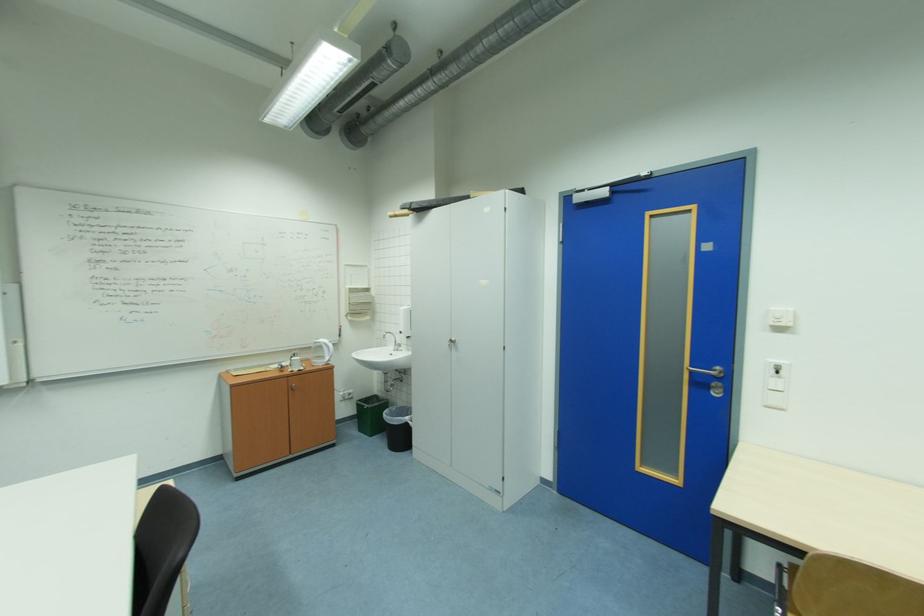
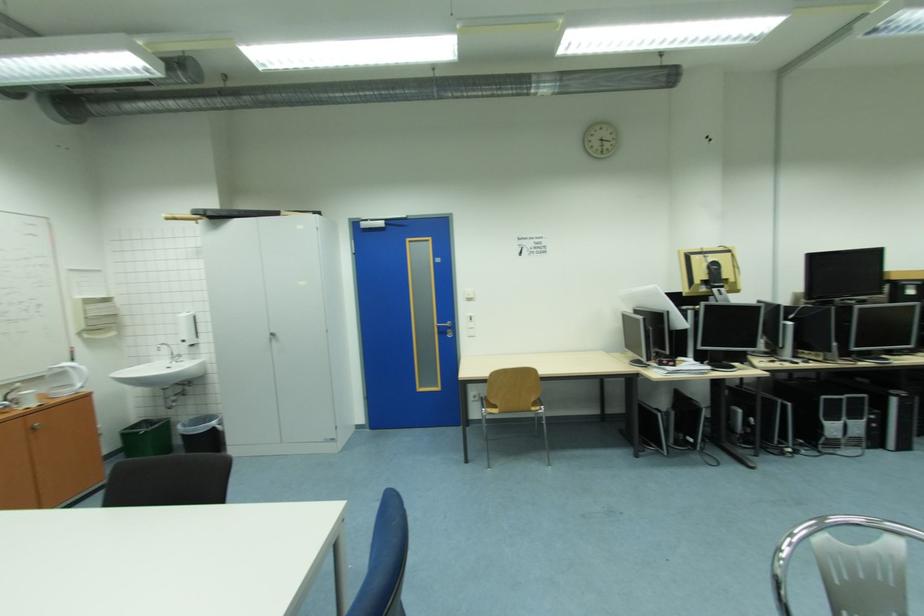
Where in the second image is the point corresponding to [415,419] from the first image?

(220, 424)